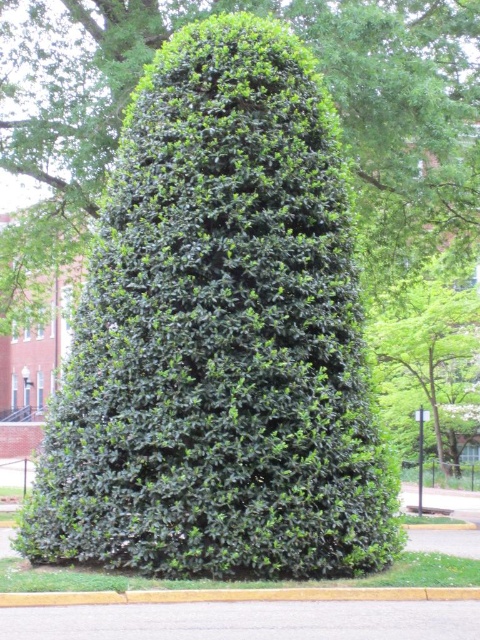
From the picture: You are standing at the center of the paved road at the bottom of the frame. Which direction should you look to see the green leafy hedge at center?

The green leafy hedge at center is located at point (x=219, y=337), so you should look upwards and towards the center of the frame to see it.

From the picture: You are standing in a landscaped area and want to walk from the green leafy hedge at center to the yellow asphalt curb at lower center. Which direction should you face to move towards the curb?

Since the green leafy hedge at center is closer to you than the yellow asphalt curb at lower center, you should face away from the hedge towards the direction of the curb to move towards it.